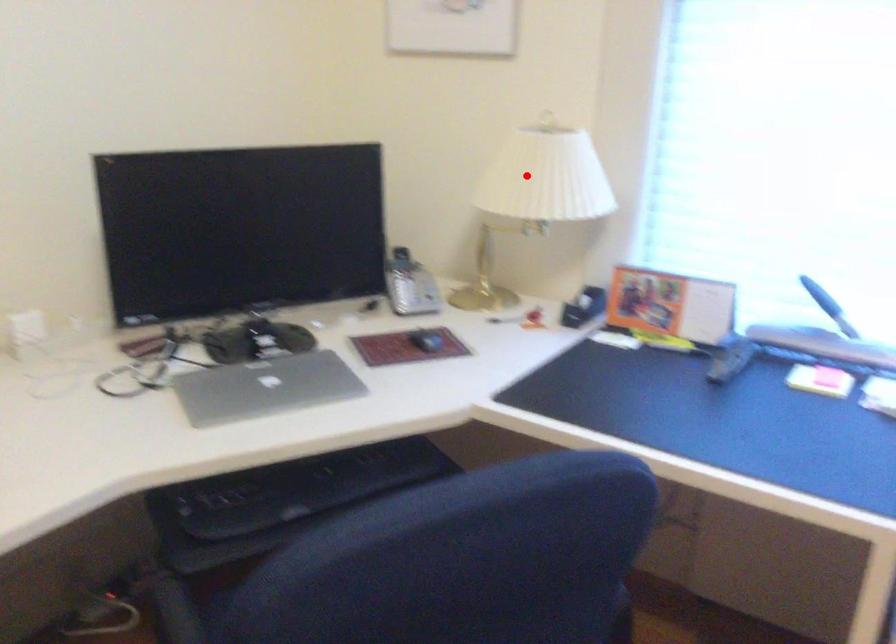
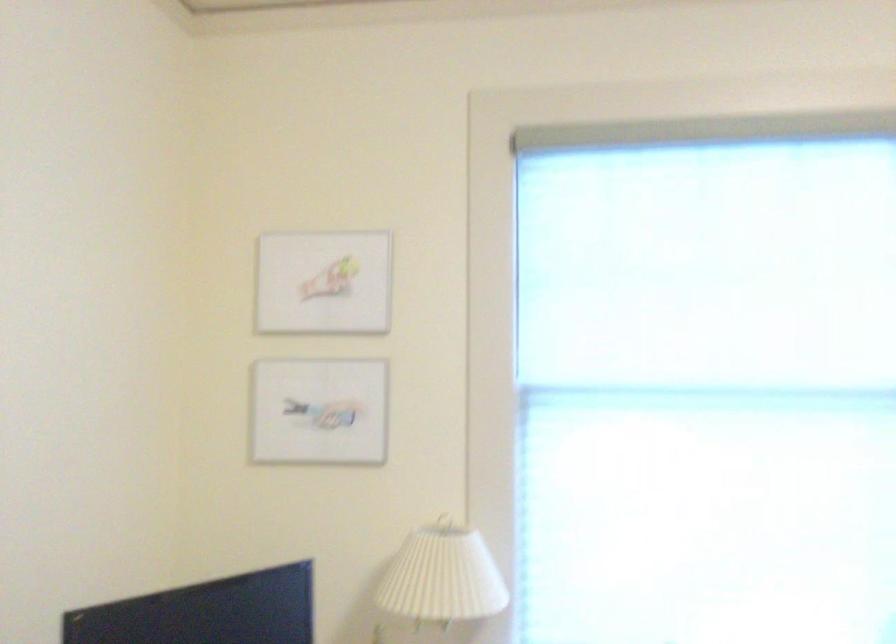
Question: I am providing you with two images of the same scene from different viewpoints. A red point is shown in image1. For the corresponding object point in image2, is it positioned nearer or farther from the camera?

Choices:
 (A) Nearer
 (B) Farther

Answer: (B)